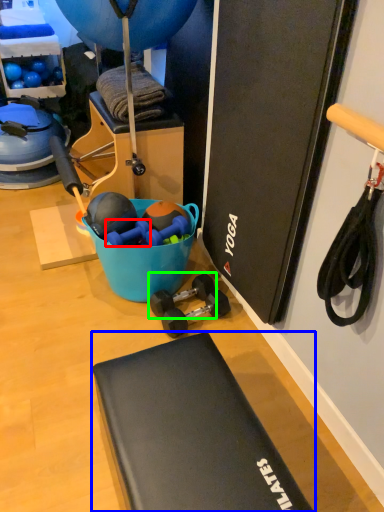
Question: Estimate the real-world distances between objects in this image. Which object is closer to dumbbell (highlighted by a red box), furniture (highlighted by a blue box) or dumbbell (highlighted by a green box)?

Choices:
 (A) furniture
 (B) dumbbell

Answer: (B)